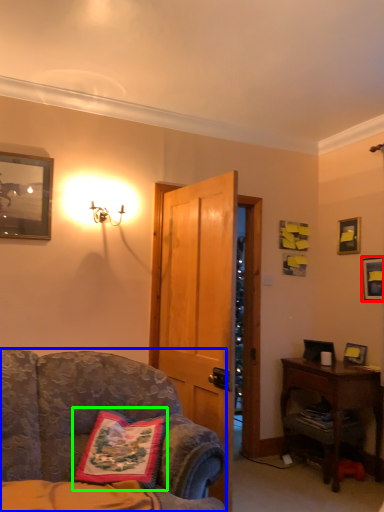
Question: Which object is positioned farthest from picture frame (highlighted by a red box)? Select from chair (highlighted by a blue box) and pillow (highlighted by a green box).

Choices:
 (A) chair
 (B) pillow

Answer: (B)